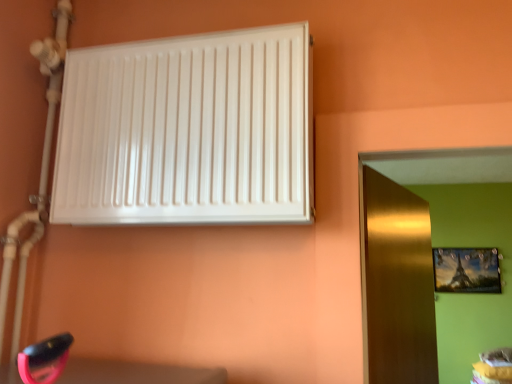
Question: Is metallic gold picture frame at upper right outside white glossy radiator at upper left?

Choices:
 (A) no
 (B) yes

Answer: (B)

Question: Can you confirm if metallic gold picture frame at upper right is thinner than white glossy radiator at upper left?

Choices:
 (A) yes
 (B) no

Answer: (A)

Question: Considering the relative positions of metallic gold picture frame at upper right and white glossy radiator at upper left in the image provided, is metallic gold picture frame at upper right in front of white glossy radiator at upper left?

Choices:
 (A) no
 (B) yes

Answer: (A)

Question: Is white glossy radiator at upper left located within metallic gold picture frame at upper right?

Choices:
 (A) yes
 (B) no

Answer: (B)

Question: Considering the relative positions of metallic gold picture frame at upper right and white glossy radiator at upper left in the image provided, is metallic gold picture frame at upper right to the right of white glossy radiator at upper left from the viewer's perspective?

Choices:
 (A) no
 (B) yes

Answer: (B)

Question: From the image's perspective, is gold metallic door at right located above or below white glossy radiator at upper left?

Choices:
 (A) above
 (B) below

Answer: (B)

Question: Does point (434, 382) appear closer or farther from the camera than point (309, 139)?

Choices:
 (A) closer
 (B) farther

Answer: (B)

Question: Is gold metallic door at right bigger or smaller than white glossy radiator at upper left?

Choices:
 (A) small
 (B) big

Answer: (B)

Question: From a real-world perspective, is gold metallic door at right above or below white glossy radiator at upper left?

Choices:
 (A) below
 (B) above

Answer: (A)

Question: In terms of size, does white glossy radiator at upper left appear bigger or smaller than gold metallic door at right?

Choices:
 (A) small
 (B) big

Answer: (A)

Question: From a real-world perspective, is white glossy radiator at upper left above or below gold metallic door at right?

Choices:
 (A) below
 (B) above

Answer: (B)

Question: Do you think white glossy radiator at upper left is within gold metallic door at right, or outside of it?

Choices:
 (A) outside
 (B) inside

Answer: (A)

Question: Relative to gold metallic door at right, is white glossy radiator at upper left in front or behind?

Choices:
 (A) front
 (B) behind

Answer: (A)

Question: Is point (445, 268) positioned closer to the camera than point (391, 218)?

Choices:
 (A) closer
 (B) farther

Answer: (B)

Question: From a real-world perspective, is metallic gold picture frame at upper right above or below gold metallic door at right?

Choices:
 (A) above
 (B) below

Answer: (A)